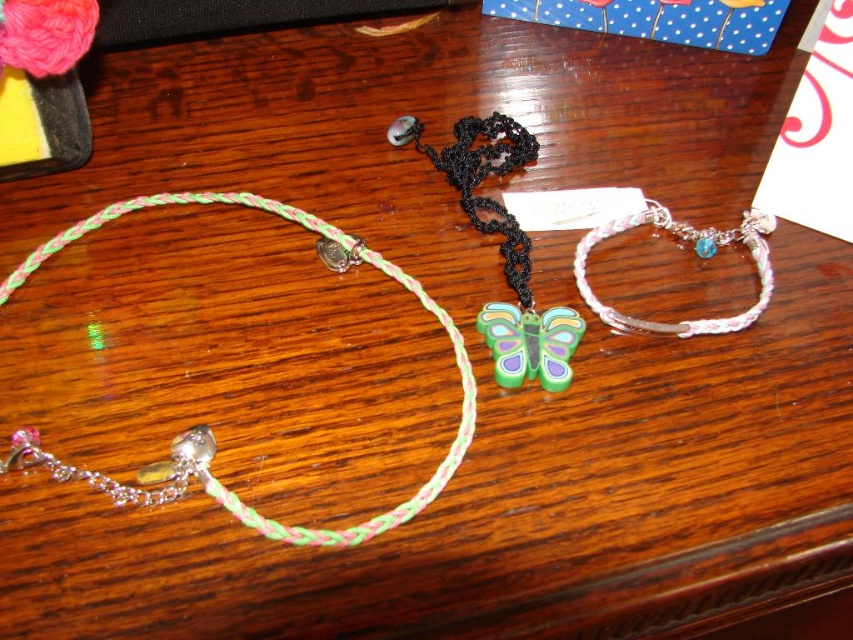
You are a customer at a jewelry store and want to know if the multicolored braided necklace at left will fit in your small jewelry box that can only accommodate items up to the height of the white braided bracelet at center. Can it fit?

The multicolored braided necklace at left is much taller than the white braided bracelet at center, so it will not fit in the jewelry box designed for items up to the height of the white braided bracelet at center.

You are a customer in a jewelry store and want to know the exact location of the multicolored braided necklace at left. Can you tell me its coordinates?

The multicolored braided necklace at left is located at coordinates point (210,429).